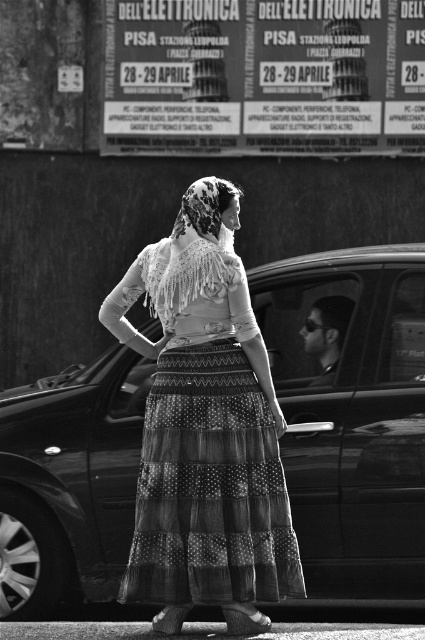
You are a photographer trying to capture the metallic car door at center and the metallic poster at upper center in the same frame. Based on their distance, can you estimate if they will both fit in your camera viewfinder?

The metallic car door at center is 19.19 feet away from metallic poster at upper center. Since the distance between them is significant, they might not both fit in the camera viewfinder without zooming out or adjusting the angle.

You are a photographer who wants to capture the textured cotton dress at center and the metallic poster at upper center in the same frame. Based on their positions, which object should you focus on first to ensure both are in the frame?

The textured cotton dress at center is to the left of the metallic poster at upper center, so you should focus on the metallic poster at upper center first to ensure both are in the frame.